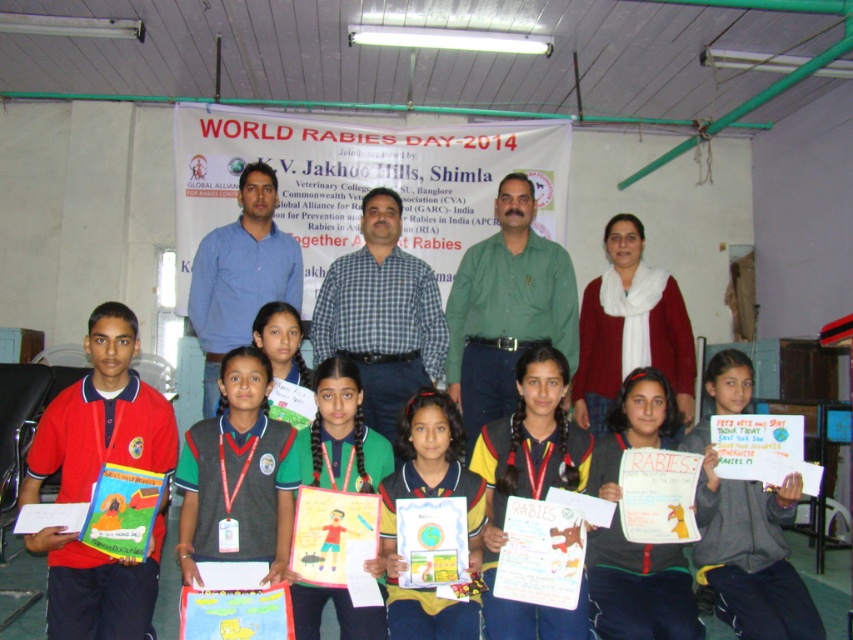
Based on the photo, is yellow fabric poster at center below green fabric uniform at center?

Correct, yellow fabric poster at center is located below green fabric uniform at center.

Which of these two, yellow fabric poster at center or green fabric uniform at center, stands taller?

yellow fabric poster at center

In order to click on yellow fabric poster at center in this screenshot , I will do `click(531, 486)`.

Is white paper poster at lower right to the right of white paper poster at center from the viewer's perspective?

Indeed, white paper poster at lower right is positioned on the right side of white paper poster at center.

Which is above, white paper poster at lower right or white paper poster at center?

white paper poster at lower right is higher up.

Image resolution: width=853 pixels, height=640 pixels. Describe the element at coordinates (747, 550) in the screenshot. I see `white paper poster at lower right` at that location.

Where is `white paper poster at lower right`? white paper poster at lower right is located at coordinates (747, 550).

Between point (544, 490) and point (461, 628), which one is positioned behind?

Point (544, 490)

Does point (521, 394) lie in front of point (474, 600)?

No, it is not.

Where is `yellow fabric poster at center`? This screenshot has height=640, width=853. yellow fabric poster at center is located at coordinates (531, 486).